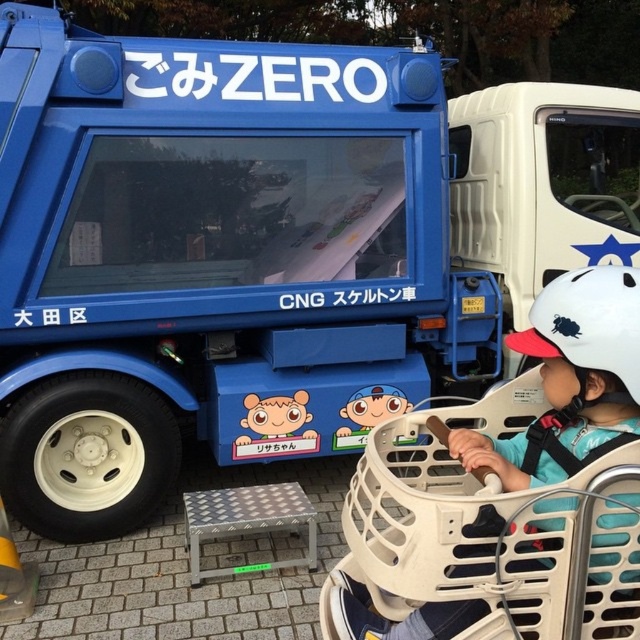
Question: Which object is farther from the camera taking this photo?

Choices:
 (A) white matte helmet at upper right
 (B) white matte helmet at center

Answer: (B)

Question: Does white matte helmet at upper right have a larger size compared to white matte helmet at center?

Choices:
 (A) no
 (B) yes

Answer: (B)

Question: From the image, what is the correct spatial relationship of white matte helmet at upper right in relation to white matte helmet at center?

Choices:
 (A) below
 (B) above

Answer: (A)

Question: Does white matte helmet at upper right lie behind white matte helmet at center?

Choices:
 (A) yes
 (B) no

Answer: (B)